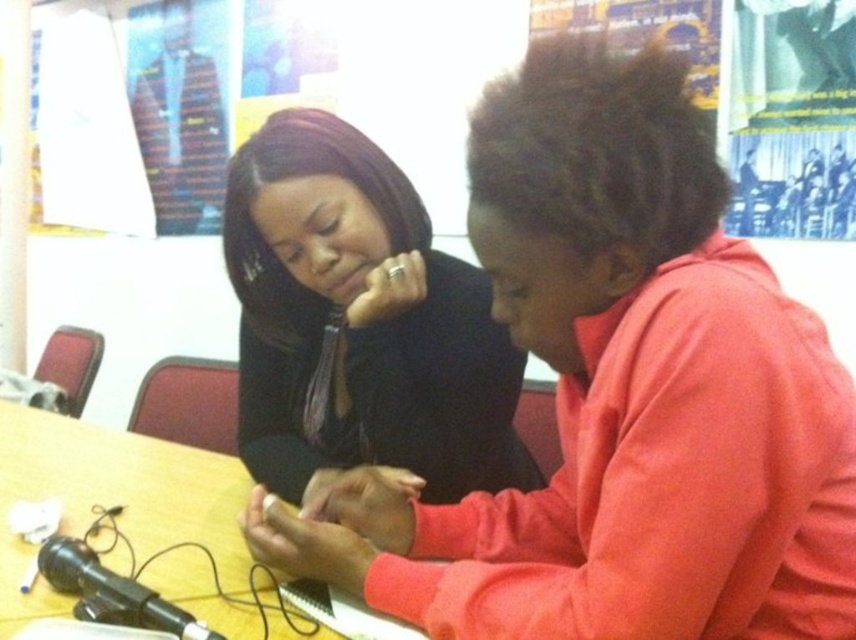
You are standing at the point labeled point (128, 568) and want to move to the point labeled point (327, 192). Which direction should you move to reach your destination?

To move from point (128, 568) to point (327, 192), you should move to the left and upwards since point (327, 192) is behind point (128, 568).

What is located at the coordinates point (617, 396)?

The coordinates point (617, 396) is occupied by the matte black shirt at center.